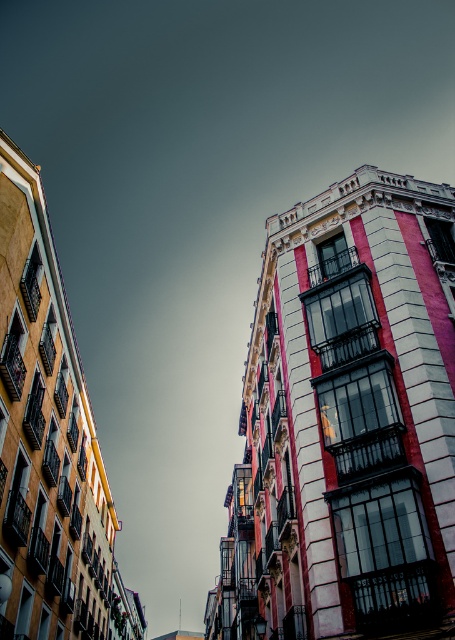
Question: Which point is farther to the camera?

Choices:
 (A) (71, 529)
 (B) (418, 548)

Answer: (A)

Question: Is smooth pink building at center below yellow painted building at left?

Choices:
 (A) yes
 (B) no

Answer: (B)

Question: Which object is farther from the camera taking this photo?

Choices:
 (A) smooth pink building at center
 (B) yellow painted building at left

Answer: (B)

Question: Is smooth pink building at center positioned in front of yellow painted building at left?

Choices:
 (A) no
 (B) yes

Answer: (B)

Question: Which point is closer to the camera?

Choices:
 (A) (448, 454)
 (B) (74, 532)

Answer: (A)

Question: Can you confirm if smooth pink building at center is positioned to the left of yellow painted building at left?

Choices:
 (A) yes
 (B) no

Answer: (B)